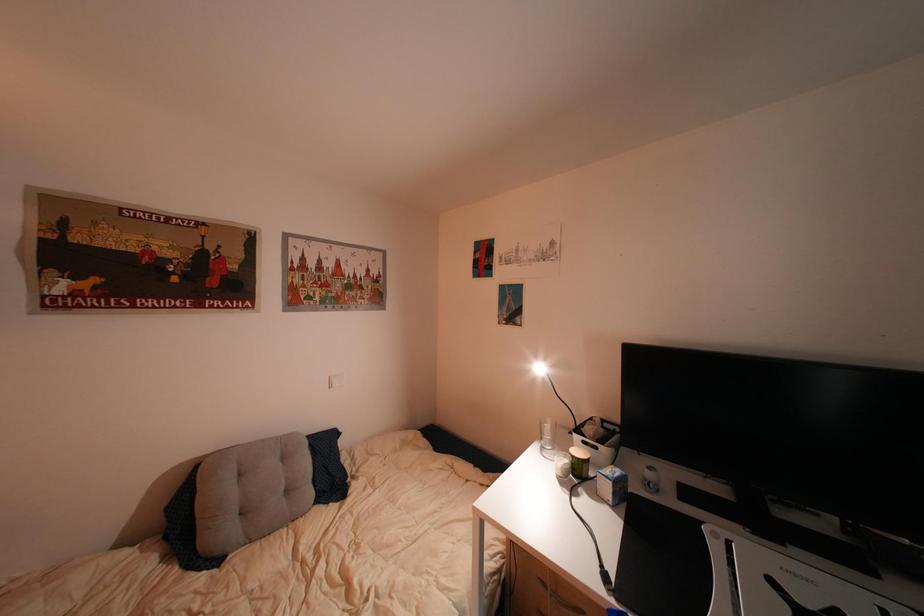
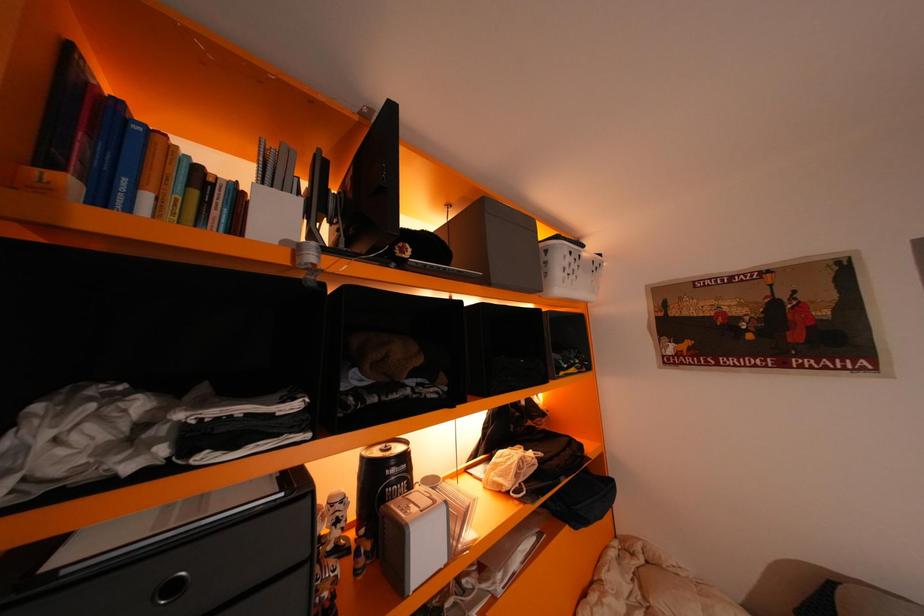
Question: Based on the continuous images, in which direction is the camera rotating? Reply with the corresponding letter.

Choices:
 (A) Left
 (B) Right
 (C) Up
 (D) Down

Answer: (A)